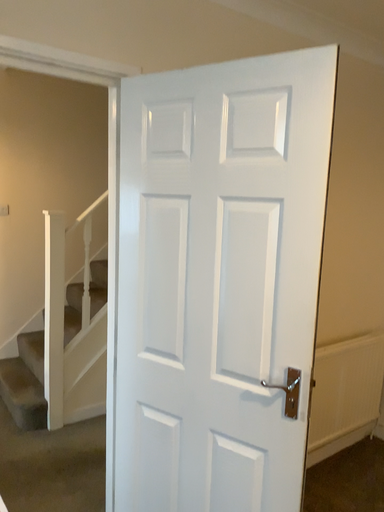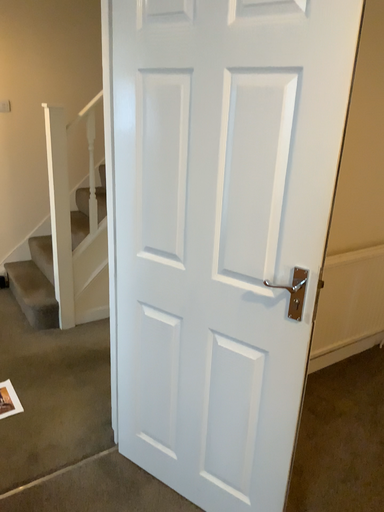
Question: Which way did the camera rotate in the video?

Choices:
 (A) rotated downward
 (B) rotated upward

Answer: (A)